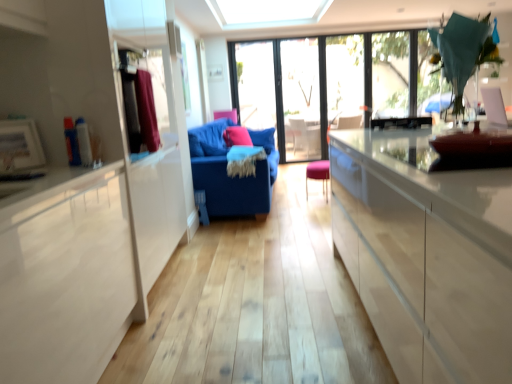
Question: Does matte pink pillow at center have a greater width compared to blue fabric couch at center?

Choices:
 (A) no
 (B) yes

Answer: (A)

Question: From the image's perspective, is matte pink pillow at center on top of blue fabric couch at center?

Choices:
 (A) no
 (B) yes

Answer: (B)

Question: Is matte pink pillow at center smaller than blue fabric couch at center?

Choices:
 (A) yes
 (B) no

Answer: (A)

Question: Is matte pink pillow at center beside blue fabric couch at center?

Choices:
 (A) yes
 (B) no

Answer: (B)

Question: Is matte pink pillow at center shorter than blue fabric couch at center?

Choices:
 (A) no
 (B) yes

Answer: (B)

Question: Considering the relative sizes of matte pink pillow at center and blue fabric couch at center in the image provided, is matte pink pillow at center taller than blue fabric couch at center?

Choices:
 (A) no
 (B) yes

Answer: (A)

Question: Can you confirm if velvet maroon curtain at left is taller than transparent glass window at upper center, which is the 2th window in left-to-right order?

Choices:
 (A) no
 (B) yes

Answer: (A)

Question: Can you confirm if velvet maroon curtain at left is positioned to the left of transparent glass window at upper center, which is the 2th window in left-to-right order?

Choices:
 (A) no
 (B) yes

Answer: (B)

Question: Is there a large distance between velvet maroon curtain at left and transparent glass window at upper center, which is the 2th window in left-to-right order?

Choices:
 (A) no
 (B) yes

Answer: (B)

Question: From the image's perspective, does velvet maroon curtain at left appear lower than transparent glass window at upper center, placed as the 1th window when sorted from right to left?

Choices:
 (A) no
 (B) yes

Answer: (B)

Question: From a real-world perspective, is velvet maroon curtain at left below transparent glass window at upper center, placed as the 1th window when sorted from right to left?

Choices:
 (A) yes
 (B) no

Answer: (A)

Question: Considering the relative sizes of velvet maroon curtain at left and transparent glass window at upper center, placed as the 1th window when sorted from right to left, in the image provided, is velvet maroon curtain at left shorter than transparent glass window at upper center, placed as the 1th window when sorted from right to left,?

Choices:
 (A) yes
 (B) no

Answer: (A)

Question: Does matte pink pillow at center have a larger size compared to transparent glass window at center, the second window in the right-to-left sequence?

Choices:
 (A) no
 (B) yes

Answer: (A)